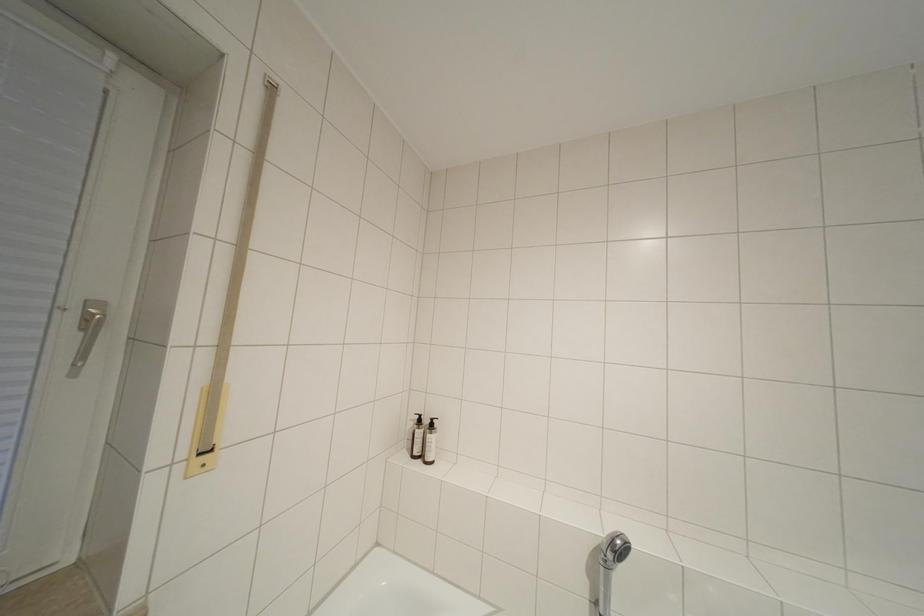
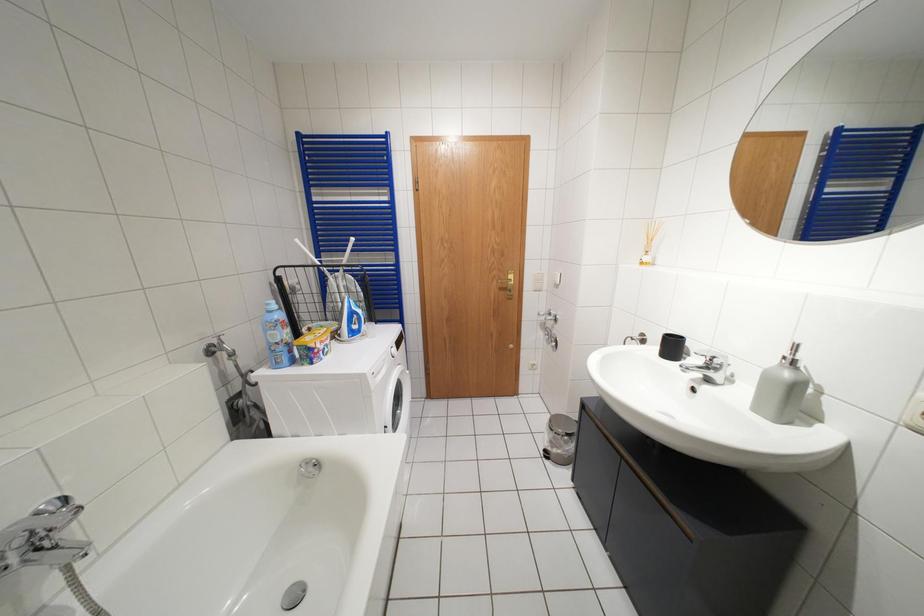
How did the camera likely rotate?

The camera's rotation is toward right-down.